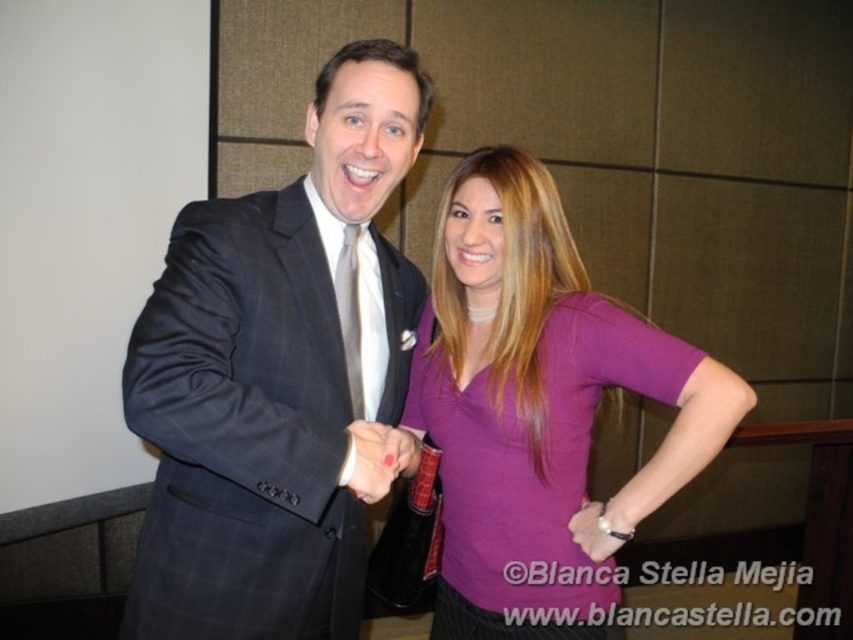
You are taking a photo of two people standing at the coordinates point (x=230, y=518) and point (x=589, y=515). Which coordinate is closer to the camera?

Point (x=230, y=518) is closer to the camera than point (x=589, y=515).

You are organizing a photo shoot and need to ensure that the matte black suit at center and the matte purple shirt at center are both visible in the frame. Given their sizes, which object should you prioritize positioning closer to the camera to maintain clarity and detail?

The matte black suit at center is bigger than the matte purple shirt at center, so you should prioritize positioning the matte black suit at center closer to the camera to maintain clarity and detail.

You are a photographer standing at a distance of 36 inches from the subjects. You want to take a closeup shot of the matte black suit at center without moving the camera. Can you do it?

The matte black suit at center is 35.91 inches away from the camera, which is slightly closer than your current position of 36 inches. Since the distance is almost the same, you can take the closeup shot without moving the camera.